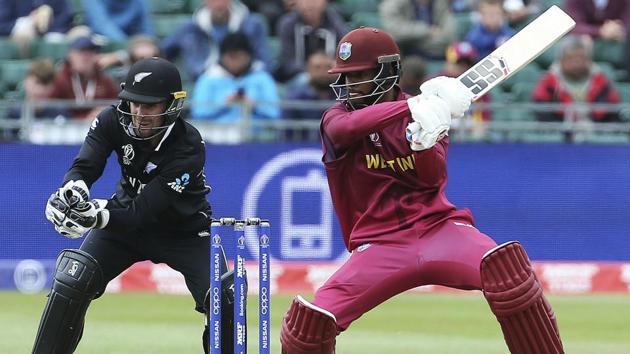
Locate an element on the screen. padding is located at coordinates coord(516,277), coord(295,334), coord(66,277), coord(227,302).